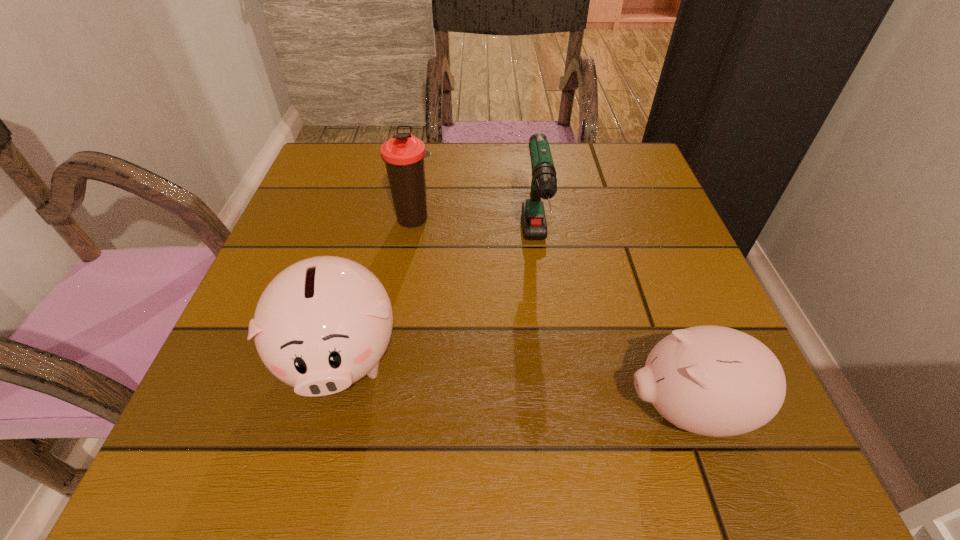
In order to click on free spot located 0.170m at the snout of the rightmost object in this screenshot , I will do `click(506, 409)`.

Identify the location of object present at the left edge. The height and width of the screenshot is (540, 960). coord(323,323).

Locate an element on the screen. This screenshot has height=540, width=960. object present at the right edge is located at coordinates (716, 381).

You are a GUI agent. You are given a task and a screenshot of the screen. Output one action in this format:
    pyautogui.click(x=<x>, y=<y>)
    Task: Click on the object present at the near left corner
    The height and width of the screenshot is (540, 960).
    Given the screenshot: What is the action you would take?
    pyautogui.click(x=323, y=323)

At what (x,y) coordinates should I click in order to perform the action: click on object that is at the near right corner. Please return your answer as a coordinate pair (x, y). This screenshot has width=960, height=540. Looking at the image, I should click on (716, 381).

This screenshot has height=540, width=960. I want to click on vacant region at the far edge, so click(474, 147).

I want to click on free space at the near edge of the desktop, so point(606,476).

Identify the location of vacant area at the left edge of the desktop. (270, 396).

Where is `free location at the right edge`? This screenshot has height=540, width=960. free location at the right edge is located at coordinates pos(663,225).

At what (x,y) coordinates should I click in order to perform the action: click on free space at the far left corner. Please return your answer as a coordinate pair (x, y). This screenshot has width=960, height=540. Looking at the image, I should click on (378, 153).